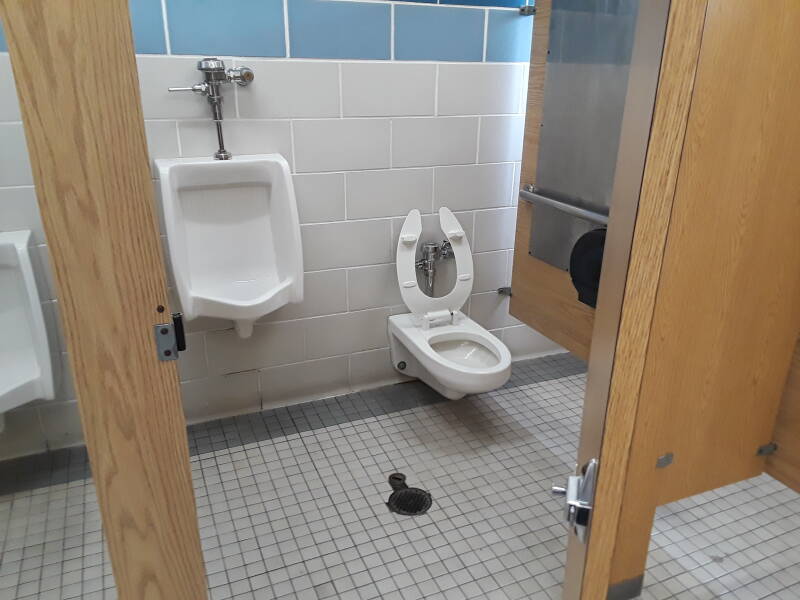
Image resolution: width=800 pixels, height=600 pixels. I want to click on floor, so click(x=476, y=563).